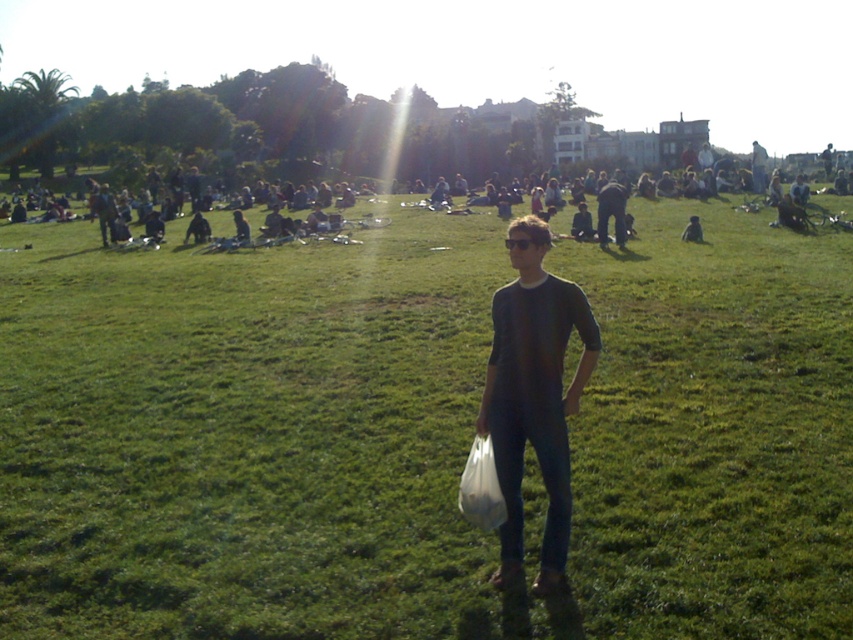
Consider the image. You are a photographer taking a picture of the person at the center of the park scene. Based on the positioning of the dark gray shirt at center and dark blue jeans at center, where should you focus your camera to ensure both elements are clearly visible in the frame?

The dark gray shirt at center is below dark blue jeans at center, so focusing on the lower half of the person will capture both the dark gray shirt at center and dark blue jeans at center clearly.

You are standing at the point labeled as point (x=418, y=435) in the image. What surface are you standing on?

You are standing on the green grassy field at center.